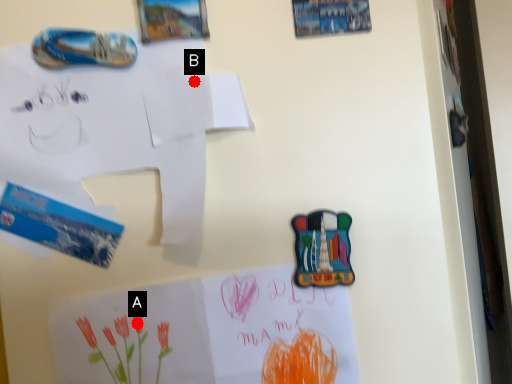
Question: Two points are circled on the image, labeled by A and B beside each circle. Which point is closer to the camera taking this photo?

Choices:
 (A) A is closer
 (B) B is closer

Answer: (A)